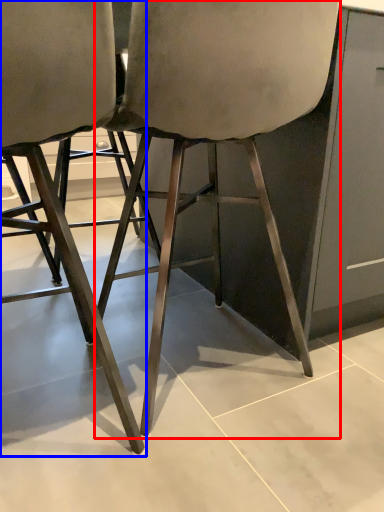
Question: Which point is further to the camera, chair (highlighted by a red box) or chair (highlighted by a blue box)?

Choices:
 (A) chair
 (B) chair

Answer: (A)